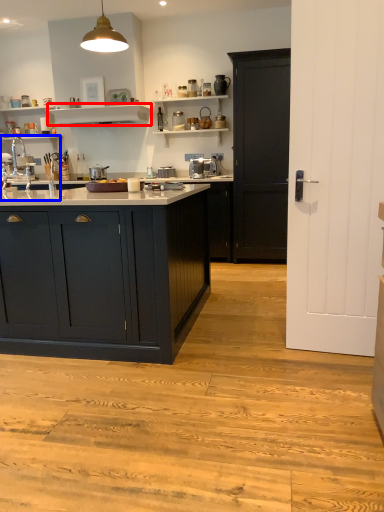
Question: Which of the following is the farthest to the observer, shelf (highlighted by a red box) or sink (highlighted by a blue box)?

Choices:
 (A) shelf
 (B) sink

Answer: (A)